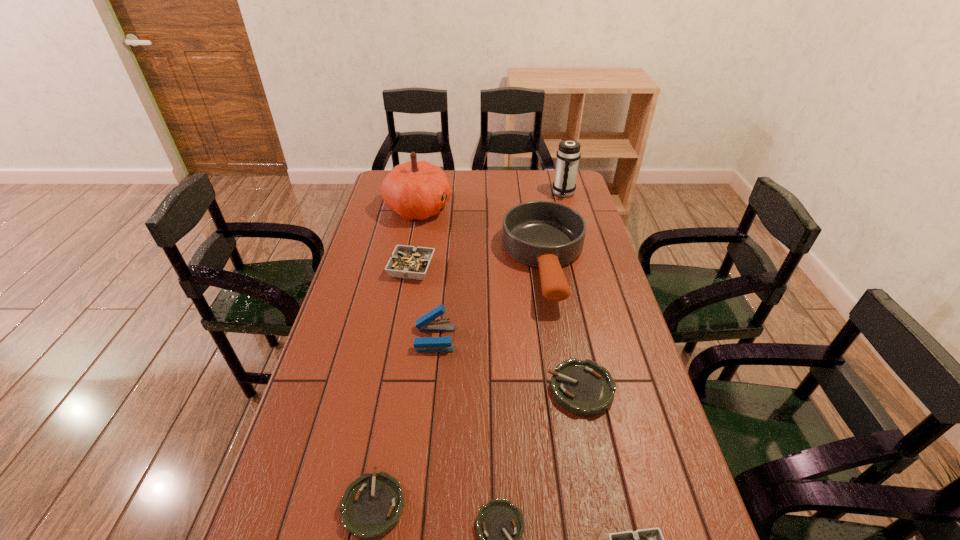
What are the coordinates of `free space that satisfies the following two spatial constraints: 1. on the back side of the stapler; 2. on the front-facing side of the pumpkin` in the screenshot? It's located at (447, 208).

The width and height of the screenshot is (960, 540). Identify the location of free location that satisfies the following two spatial constraints: 1. on the front-facing side of the pink pumpkin; 2. on the left side of the sixth shortest object. (394, 339).

Where is `free space that satisfies the following two spatial constraints: 1. on the side with the handle of the thermos bottle; 2. on the front-facing side of the pumpkin`? free space that satisfies the following two spatial constraints: 1. on the side with the handle of the thermos bottle; 2. on the front-facing side of the pumpkin is located at coordinates (567, 208).

Identify the location of free space that satisfies the following two spatial constraints: 1. on the front-facing side of the bigger gray ashtray; 2. on the left side of the pink pumpkin. This screenshot has width=960, height=540. (407, 268).